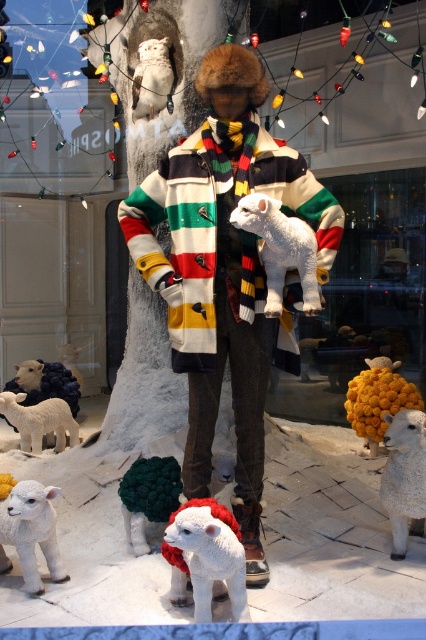
Question: Which object is closer to the camera taking this photo?

Choices:
 (A) white fluffy lamb at lower center
 (B) fluffy yellow sheep at center

Answer: (A)

Question: Which of the following is the closest to the observer?

Choices:
 (A) click(x=146, y=269)
 (B) click(x=210, y=554)
 (C) click(x=362, y=422)

Answer: (B)

Question: Is fluffy white lamb at lower center further to camera compared to white woolen sheep at lower left?

Choices:
 (A) yes
 (B) no

Answer: (B)

Question: Does striped wool coat at center have a lesser width compared to white woolen sheep at lower left?

Choices:
 (A) yes
 (B) no

Answer: (B)

Question: Which point appears closest to the camera in this image?

Choices:
 (A) (37, 516)
 (B) (379, 420)
 (C) (282, 221)

Answer: (C)

Question: Can you confirm if striped wool coat at center is smaller than white woolen lamb at lower left?

Choices:
 (A) no
 (B) yes

Answer: (A)